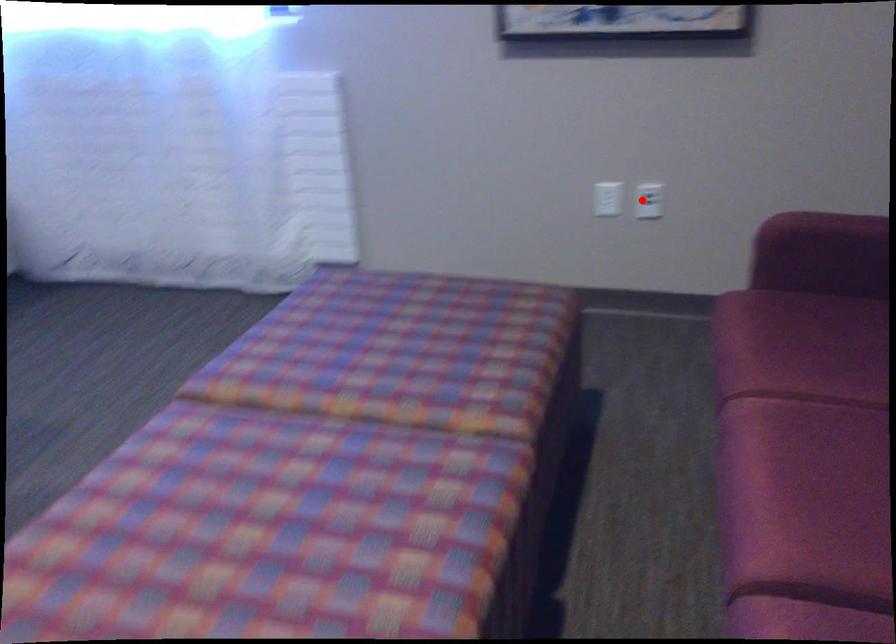
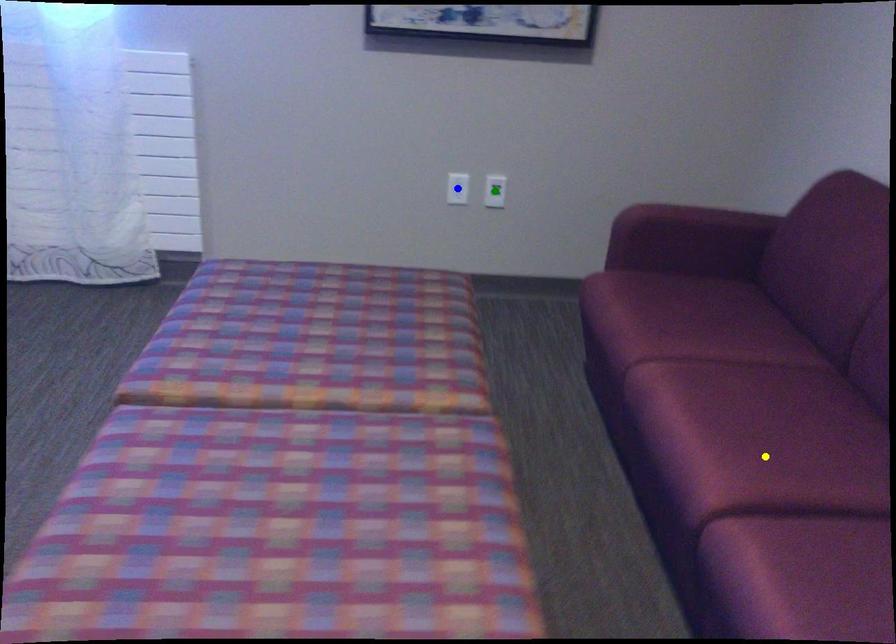
Question: I am providing you with two images of the same scene from different viewpoints. A red point is marked on the first image. You are given multiple points on the second image. Which mark in image 2 goes with the point in image 1?

Choices:
 (A) yellow point
 (B) blue point
 (C) green point

Answer: (C)